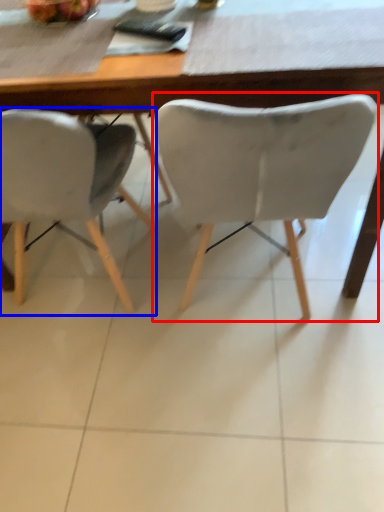
Question: Which of the following is the closest to the observer, chair (highlighted by a red box) or chair (highlighted by a blue box)?

Choices:
 (A) chair
 (B) chair

Answer: (A)